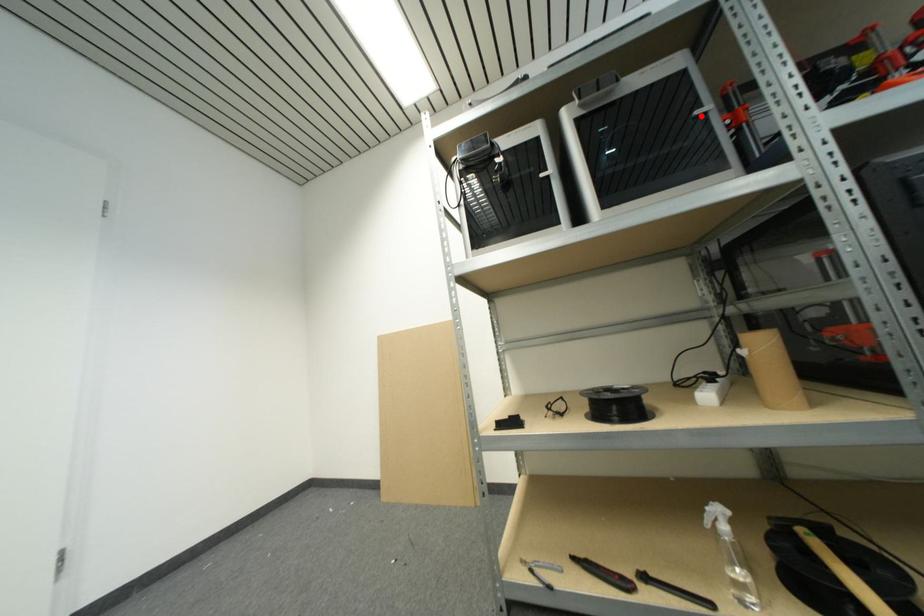
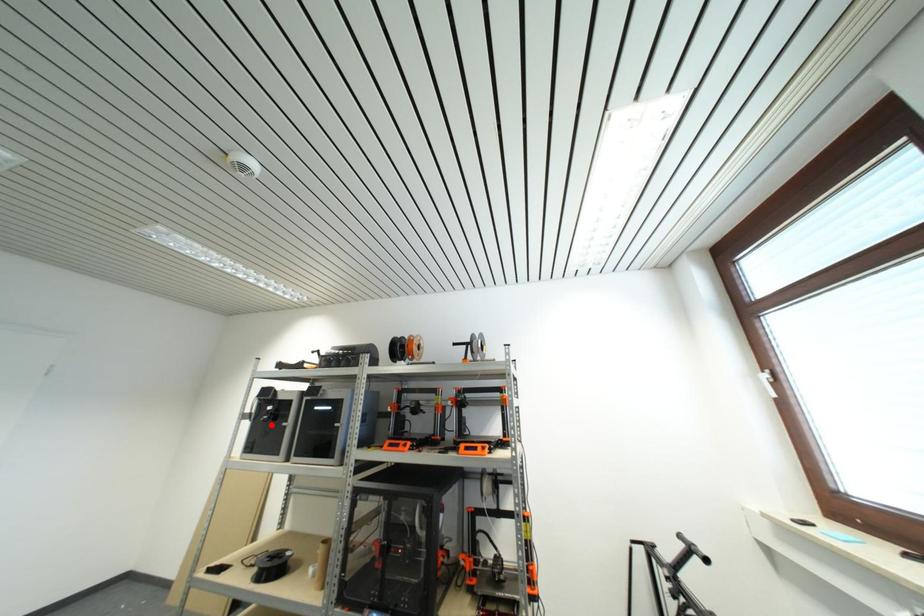
I am providing you with two images of the same scene from different viewpoints. A red point is marked on the first image and another point is marked on the second image. Is the red point in image1 aligned with the point shown in image2?

No